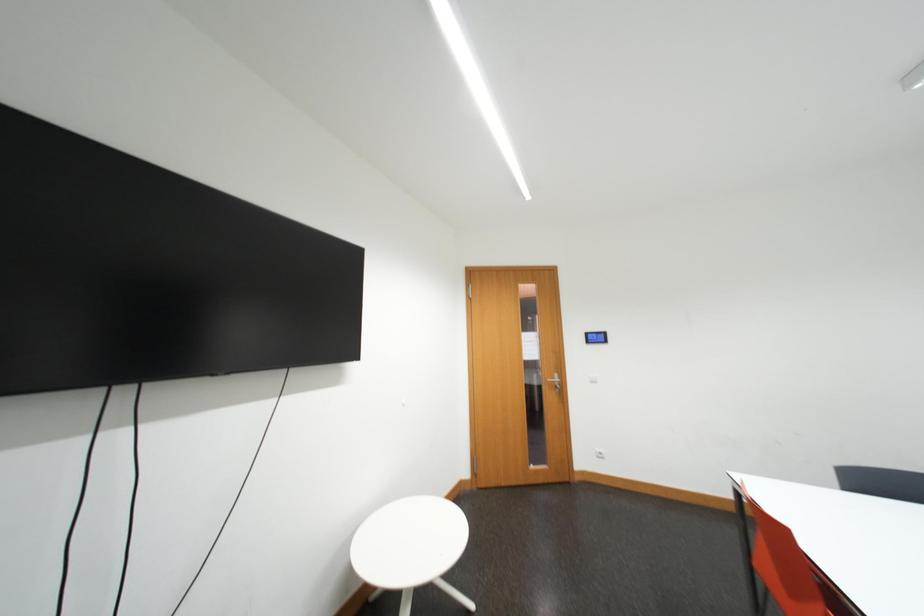
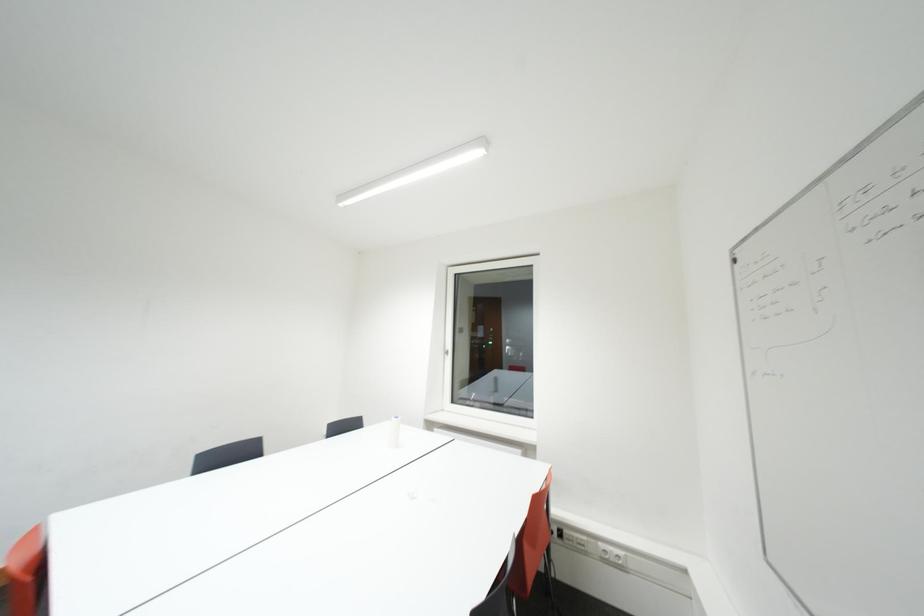
Question: The camera is either moving clockwise (left) or counter-clockwise (right) around the object. The first image is from the beginning of the video and the second image is from the end. Is the camera moving left or right when shooting the video?

Choices:
 (A) Left
 (B) Right

Answer: (A)